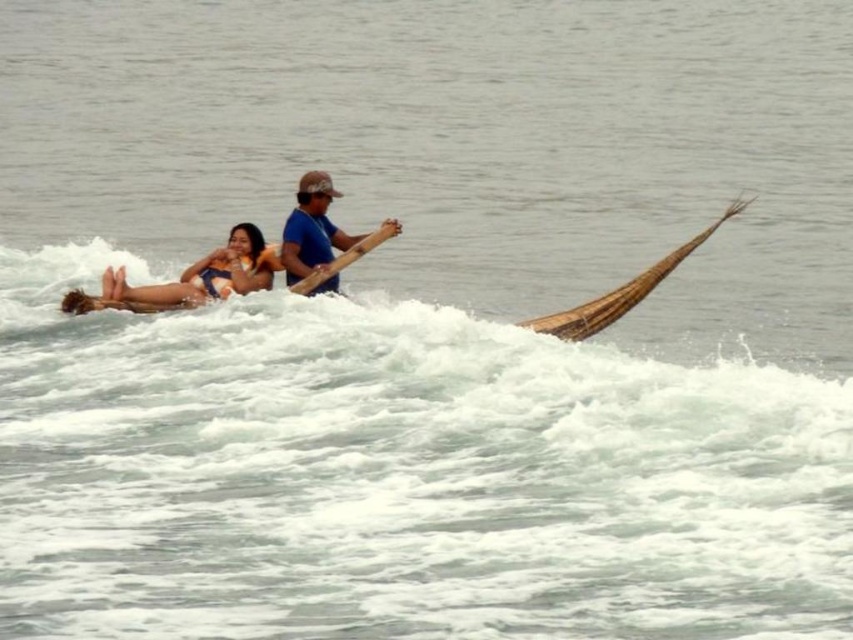
You are a photographer on a boat and want to capture the orange bikini at center in your shot. The boat is moving, so you need to stabilize your camera. The boat is currently at point A, and you need to move to point B, which is at point [248,260]. Is the orange bikini at center located at point B?

Yes, the orange bikini at center is located at point B, which is at point [248,260]. You can move your camera to that point to capture it.

Looking at this image, you are a photographer on a nearby boat taking pictures of the scene. You notice the orange bikini top at left and the brown woven canoe at right. Which object is positioned more to the left side of the image?

The orange bikini top at left is positioned more to the left side of the image than the brown woven canoe at right.

You are a photographer trying to capture a photo of the orange bikini top at left and the brown woven canoe at right. Which object should you focus on first if you want to include both in your frame without moving the camera?

The orange bikini top at left should be focused on first because it is closer to the camera than the brown woven canoe at right, allowing both to be in the frame without moving the camera.